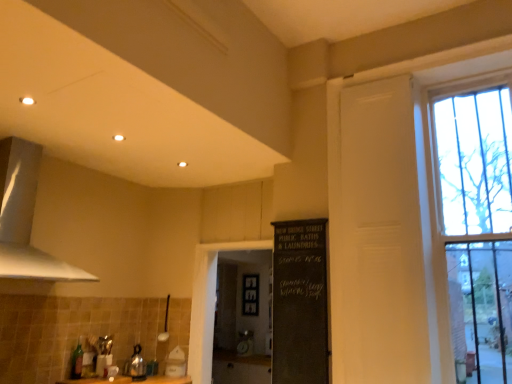
Where is `vacant area on top of black chalkboard at center (from a real-world perspective)`? The image size is (512, 384). vacant area on top of black chalkboard at center (from a real-world perspective) is located at coordinates (296, 220).